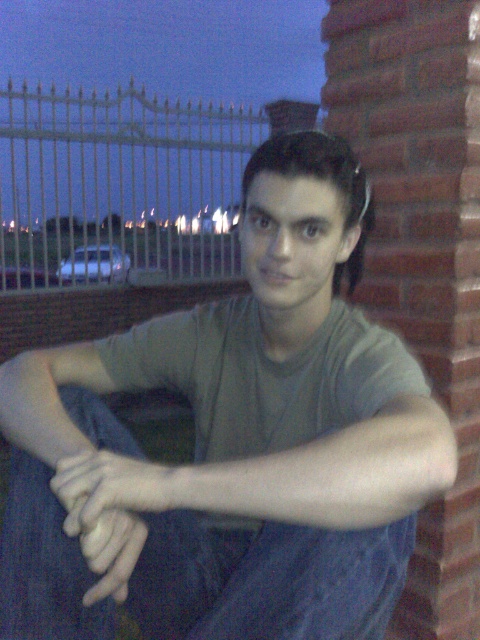
You are a photographer setting up a shot of the person sitting against the brick wall. You want to ensure the white metal fence at upper left and the denim at left are both visible in the frame. Considering their heights, which object should you position closer to the bottom of the frame?

The denim at left is shorter than the white metal fence at upper left, so you should position the denim at left closer to the bottom of the frame to ensure both are visible.

From the picture: You are a drone operator trying to capture a photo of the person sitting against the brick wall. The white metal fence at upper left is in the way of your shot. To avoid the fence, should you adjust your drone to the right or left?

The white metal fence at upper left is located at point (120, 188), so to avoid it, you should adjust your drone to the right.